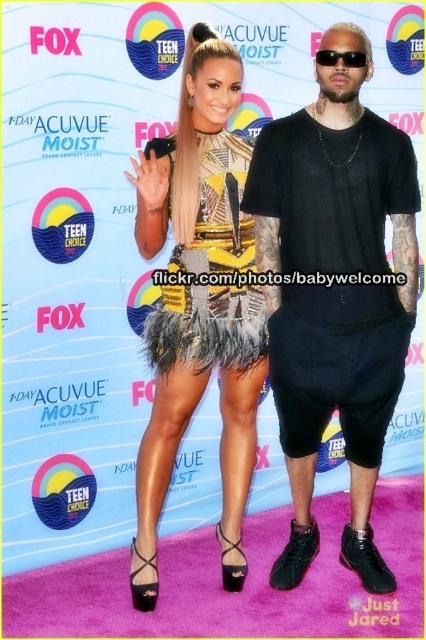
Question: Which of the following is the closest to the observer?

Choices:
 (A) (227, 205)
 (B) (210, 157)
 (C) (354, 49)

Answer: (C)

Question: Is black matte t-shirt at center below feathered yellow dress at center?

Choices:
 (A) no
 (B) yes

Answer: (B)

Question: Can you confirm if black matte t-shirt at center is thinner than feathered dress at center?

Choices:
 (A) no
 (B) yes

Answer: (A)

Question: Which object is farther from the camera taking this photo?

Choices:
 (A) feathered yellow dress at center
 (B) feathered dress at center

Answer: (A)

Question: From the image, what is the correct spatial relationship of black matte t-shirt at center in relation to feathered dress at center?

Choices:
 (A) above
 (B) below

Answer: (B)

Question: Which of the following is the farthest from the observer?

Choices:
 (A) feathered dress at center
 (B) black matte t-shirt at center
 (C) feathered yellow dress at center

Answer: (C)